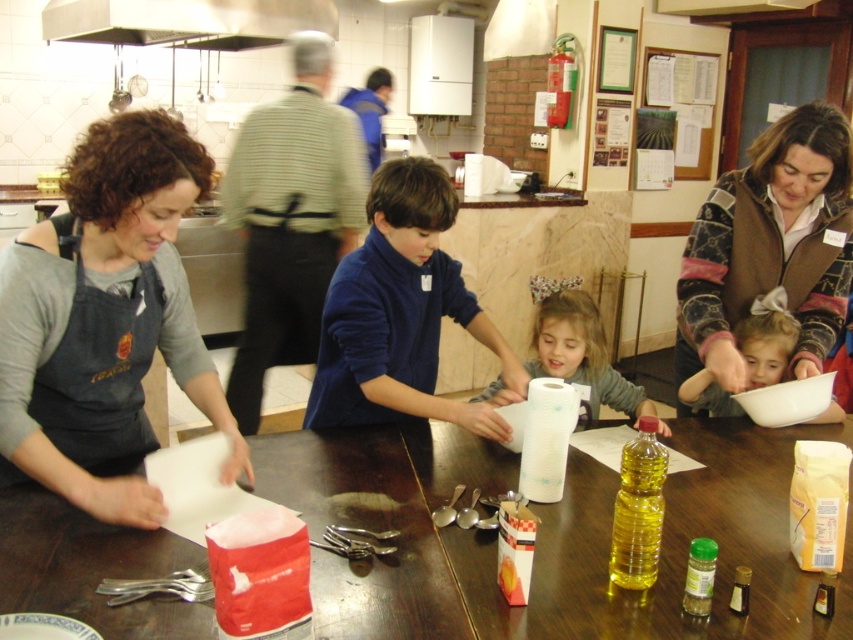
From the picture: Between wooden table at center and dark gray apron at left, which one is positioned higher?

Positioned higher is dark gray apron at left.

From the picture: Between wooden table at center and dark gray apron at left, which one has more height?

dark gray apron at left is taller.

The image size is (853, 640). Describe the element at coordinates (547, 536) in the screenshot. I see `wooden table at center` at that location.

Where is `wooden table at center`? The height and width of the screenshot is (640, 853). wooden table at center is located at coordinates (547, 536).

Is wooden table at center to the left of smooth white paper towel at center from the viewer's perspective?

Yes, wooden table at center is to the left of smooth white paper towel at center.

Does point (358, 577) lie in front of point (553, 362)?

Yes.

Between point (773, 465) and point (553, 358), which one is positioned behind?

The point (553, 358) is behind.

This screenshot has height=640, width=853. I want to click on wooden table at center, so click(x=547, y=536).

Does knitted sweater at center come behind metallic at upper left?

No.

Does knitted sweater at center have a greater width compared to metallic at upper left?

No.

Between point (799, 196) and point (138, 42), which one is positioned in front?

Positioned in front is point (799, 196).

Where is `knitted sweater at center`? Image resolution: width=853 pixels, height=640 pixels. knitted sweater at center is located at coordinates (770, 248).